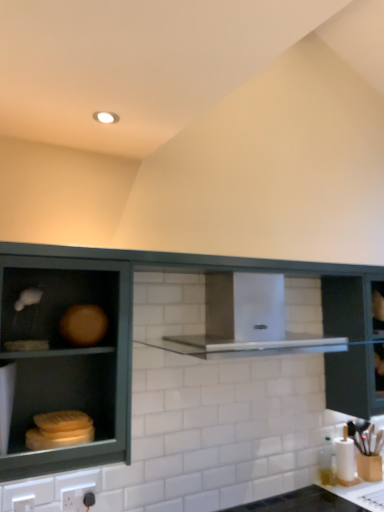
Question: From a real-world perspective, is white plastic electric outlet at lower left, which is the 1th electric outlet in left-to-right order, positioned above or below matte wood cabinet at left, which is the second cabinetry from back to front?

Choices:
 (A) below
 (B) above

Answer: (A)

Question: From the image's perspective, is white plastic electric outlet at lower left, which is counted as the second electric outlet, starting from the right, positioned above or below matte wood cabinet at left, which is the second cabinetry from back to front?

Choices:
 (A) below
 (B) above

Answer: (A)

Question: Which of these objects is positioned closest to the green matte cabinet at left, positioned as the second cabinetry in front-to-back order?

Choices:
 (A) stainless steel vent at center
 (B) black plastic electric outlet at lower center, which appears as the second electric outlet when viewed from the front
 (C) matte wood cabinet at left, which is the second cabinetry from back to front
 (D) white plastic electric outlet at lower left, the 1th electric outlet positioned from the front
 (E) black glossy countertop at lower right

Answer: (C)

Question: Which object is the closest to the stainless steel vent at center?

Choices:
 (A) black plastic electric outlet at lower center, positioned as the 1th electric outlet in right-to-left order
 (B) white plastic electric outlet at lower left, the 2th electric outlet viewed from the back
 (C) black glossy countertop at lower right
 (D) matte wood cabinet at left, which is the second cabinetry from back to front
 (E) transparent glass cabinet at right

Answer: (E)